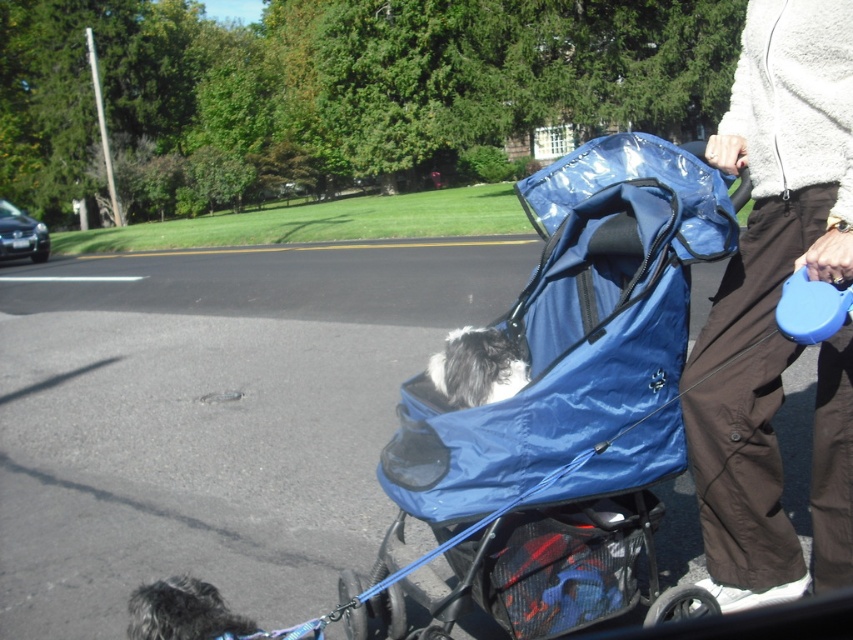
The height and width of the screenshot is (640, 853). What do you see at coordinates (477, 365) in the screenshot?
I see `fluffy gray dog in stroller at center` at bounding box center [477, 365].

Is fluffy gray dog in stroller at center below shaggy fur dog at lower left?

No.

Who is more forward, (447, 337) or (144, 624)?

Positioned in front is point (144, 624).

Where is `fluffy gray dog in stroller at center`? The image size is (853, 640). fluffy gray dog in stroller at center is located at coordinates (477, 365).

The height and width of the screenshot is (640, 853). Describe the element at coordinates (773, 308) in the screenshot. I see `brown cotton pants at right` at that location.

Is point (817, 168) behind point (444, 364)?

That is False.

This screenshot has height=640, width=853. What are the coordinates of `brown cotton pants at right` in the screenshot? It's located at (773, 308).

Who is more distant from viewer, [509,436] or [730,497]?

The point [730,497] is behind.

At what (x,y) coordinates should I click in order to perform the action: click on blue glossy stroller at center. Please return your answer as a coordinate pair (x, y). Looking at the image, I should click on (566, 397).

Find the location of `blue glossy stroller at center`. blue glossy stroller at center is located at coordinates (566, 397).